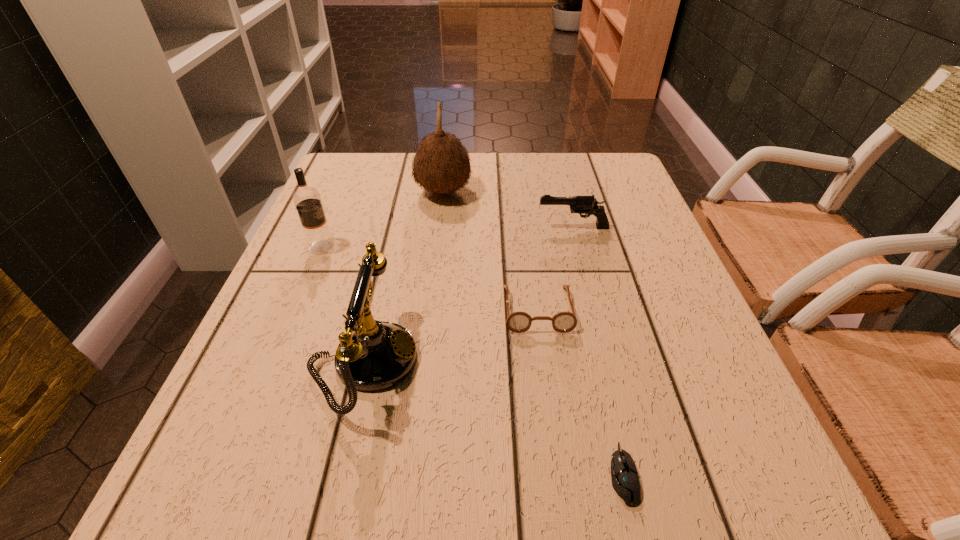
Locate an element on the screen. The image size is (960, 540). free space located on the label of the leftmost object is located at coordinates (485, 247).

Image resolution: width=960 pixels, height=540 pixels. Identify the location of vacant space situated on the dial of the telephone. (517, 362).

Identify the location of free spot located 0.080m at the end of the barrel of the second farthest object. click(503, 227).

Find the location of a particular element. This screenshot has width=960, height=540. vacant space located at the end of the barrel of the second farthest object is located at coordinates (456, 227).

The image size is (960, 540). I want to click on vacant space located at the end of the barrel of the second farthest object, so click(x=404, y=227).

Where is `vacant area located on the front-facing side of the fifth tallest object`? vacant area located on the front-facing side of the fifth tallest object is located at coordinates (555, 447).

Identify the location of free space located 0.080m on the left of the shortest object. (552, 474).

The width and height of the screenshot is (960, 540). I want to click on object present at the far edge, so click(x=441, y=165).

Identify the location of object that is positioned at the near edge. point(625,480).

Where is `vodka that is at the left edge`? This screenshot has height=540, width=960. vodka that is at the left edge is located at coordinates (307, 200).